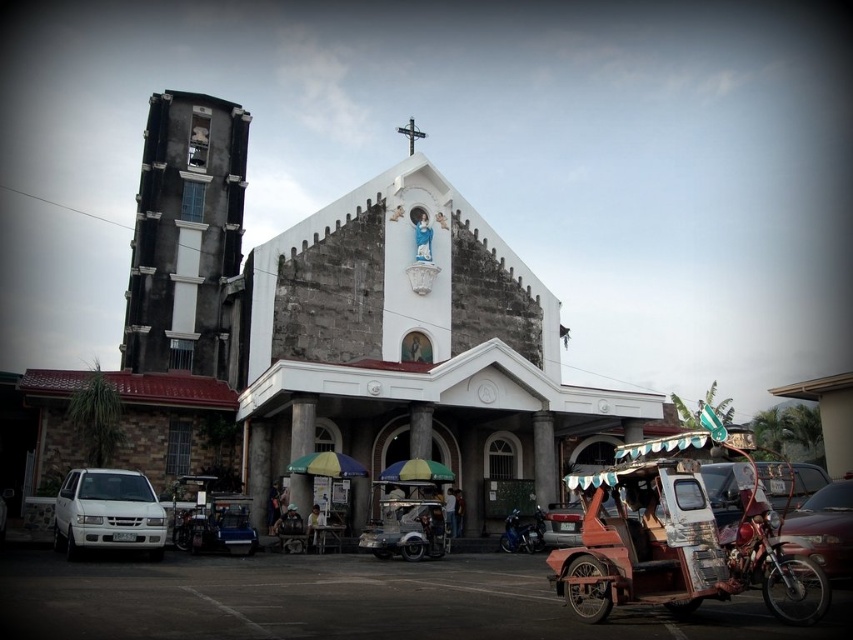
Which is below, white stone chapel at center or shiny blue motorcycle at lower center?

shiny blue motorcycle at lower center is lower down.

Which is in front, point (451, 333) or point (525, 548)?

Positioned in front is point (525, 548).

At what (x,y) coordinates should I click in order to perform the action: click on white stone chapel at center. Please return your answer as a coordinate pair (x, y). Looking at the image, I should click on (412, 349).

Is point (693, 532) positioned behind point (541, 531)?

No.

The image size is (853, 640). Identify the location of rusty metal cart at lower right. (677, 538).

Which is more to the left, metallic silver tricycle at center or shiny blue motorcycle at lower center?

Positioned to the left is metallic silver tricycle at center.

Does metallic silver tricycle at center appear over shiny blue motorcycle at lower center?

Yes.

Which is in front, point (430, 532) or point (526, 548)?

Point (430, 532) is more forward.

At what (x,y) coordinates should I click in order to perform the action: click on metallic silver tricycle at center. Please return your answer as a coordinate pair (x, y). This screenshot has width=853, height=640. Looking at the image, I should click on (405, 531).